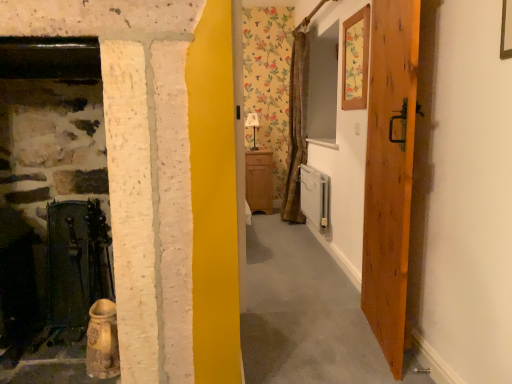
Where is `vacant space in wooden door at right (from a real-world perspective)`? The width and height of the screenshot is (512, 384). vacant space in wooden door at right (from a real-world perspective) is located at coordinates (372, 334).